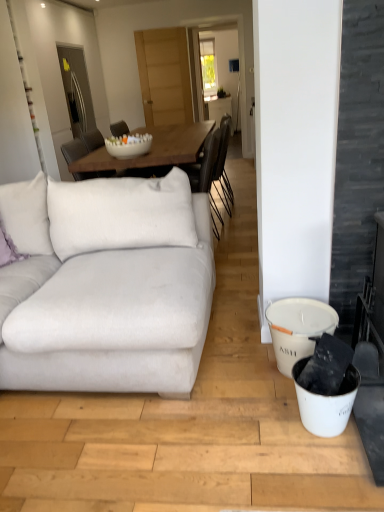
Question: Considering the relative positions of purple velvet pillow at left and white glossy bowl at center in the image provided, is purple velvet pillow at left to the left or to the right of white glossy bowl at center?

Choices:
 (A) right
 (B) left

Answer: (B)

Question: Considering the positions of purple velvet pillow at left and white glossy bowl at center in the image, is purple velvet pillow at left taller or shorter than white glossy bowl at center?

Choices:
 (A) tall
 (B) short

Answer: (A)

Question: Based on their relative distances, which object is nearer to the purple velvet pillow at left?

Choices:
 (A) white fabric couch at left
 (B) white glossy bowl at center
 (C) white matte bucket at lower right

Answer: (A)

Question: Which is farther from the white matte bucket at lower right?

Choices:
 (A) purple velvet pillow at left
 (B) white fabric couch at left
 (C) white glossy bowl at center

Answer: (C)